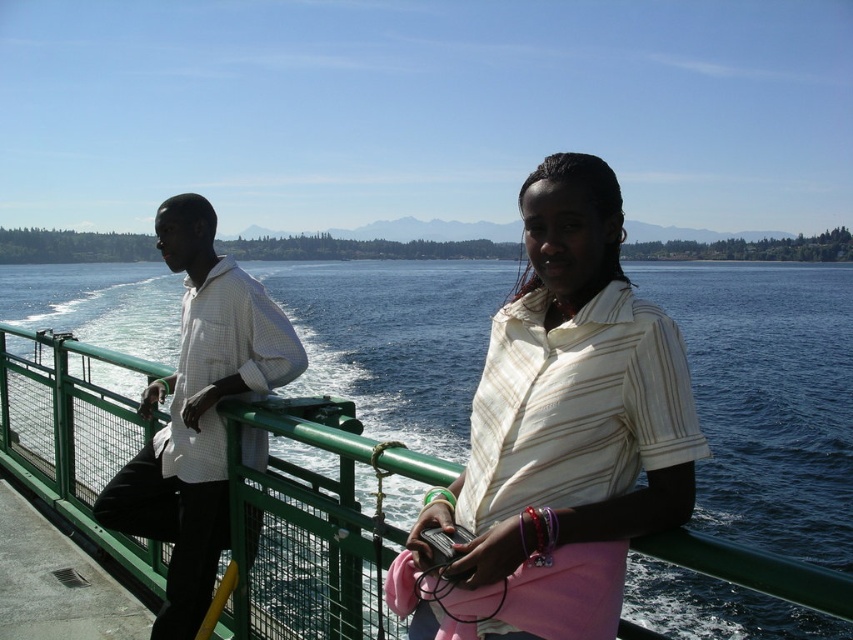
You are a photographer on a ferry deck and need to capture both the white striped shirt at center and the white checkered shirt at left in a single frame. Based on their heights, which person should you position closer to the camera to ensure both are fully visible?

The white striped shirt at center is taller than the white checkered shirt at left. To ensure both are fully visible in the frame, position the white checkered shirt at left closer to the camera since they are shorter, allowing their full height to be captured while the taller individual at the center can be framed appropriately in the background.

You are a photographer trying to capture a shot of the blue water at center and the white striped shirt at center. Which object appears taller in the frame?

The blue water at center appears taller than the white striped shirt at center in the frame.

You are standing on the deck of a ferry and see the blue water at center and the white checkered shirt at left. Which object appears taller from your perspective?

The blue water at center appears taller than the white checkered shirt at left because it has a greater height compared to it according to the description.